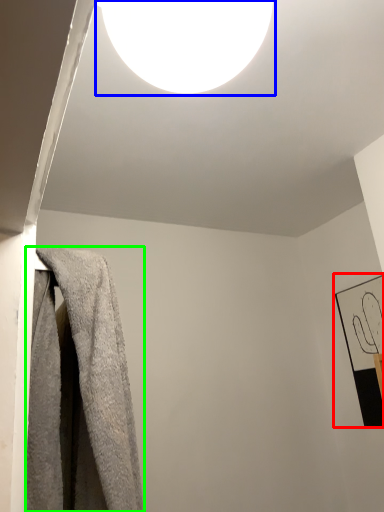
Question: Based on their relative distances, which object is nearer to picture frame (highlighted by a red box)? Choose from lamp (highlighted by a blue box) and towel (highlighted by a green box).

Choices:
 (A) lamp
 (B) towel

Answer: (B)